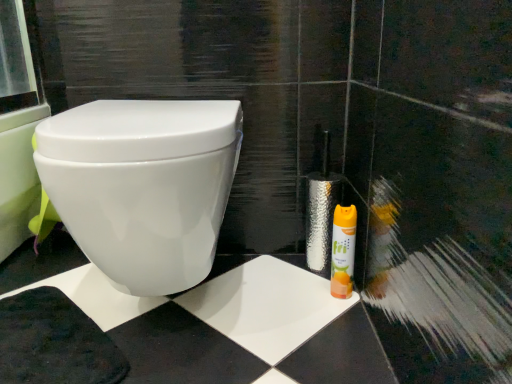
Find the location of a particular element. The width and height of the screenshot is (512, 384). vacant space that is to the left of yellow matte canister at lower right is located at coordinates (276, 294).